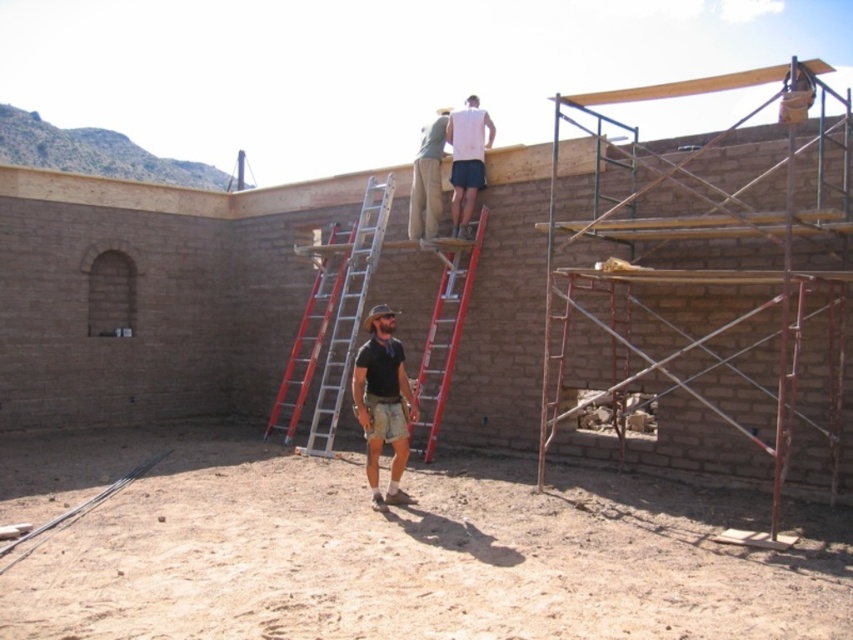
Who is positioned more to the left, dark brown leather boots at center or red aluminum ladder at upper center?

dark brown leather boots at center

Is point (407, 400) positioned behind point (444, 339)?

No, (407, 400) is closer to viewer.

Which is behind, point (364, 365) or point (479, 243)?

Point (479, 243)

At what (x,y) coordinates should I click in order to perform the action: click on dark brown leather boots at center. Please return your answer as a coordinate pair (x, y). This screenshot has width=853, height=640. Looking at the image, I should click on (381, 403).

Can you confirm if white matte shirt at upper center is wider than khaki cotton pants at upper center?

Indeed, white matte shirt at upper center has a greater width compared to khaki cotton pants at upper center.

What do you see at coordinates (467, 160) in the screenshot? I see `white matte shirt at upper center` at bounding box center [467, 160].

This screenshot has height=640, width=853. I want to click on white matte shirt at upper center, so click(467, 160).

Is dark brown leather boots at center wider than khaki cotton pants at upper center?

Indeed, dark brown leather boots at center has a greater width compared to khaki cotton pants at upper center.

Who is positioned more to the right, dark brown leather boots at center or khaki cotton pants at upper center?

From the viewer's perspective, khaki cotton pants at upper center appears more on the right side.

Between point (370, 404) and point (422, 157), which one is positioned behind?

The point (422, 157) is more distant.

Identify the location of dark brown leather boots at center. The height and width of the screenshot is (640, 853). (381, 403).